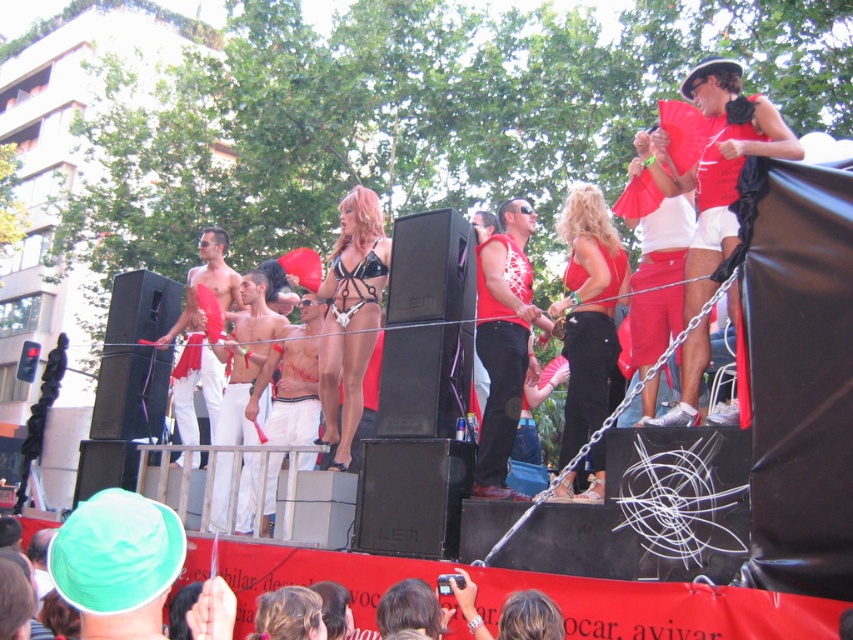
Question: Can you confirm if matte red top at center is wider than matte white pants at center?

Choices:
 (A) yes
 (B) no

Answer: (B)

Question: Can you confirm if shiny white shorts at center is wider than matte white pants at center?

Choices:
 (A) yes
 (B) no

Answer: (B)

Question: Can you confirm if matte red shorts at upper right is positioned to the right of matte red top at center?

Choices:
 (A) yes
 (B) no

Answer: (B)

Question: Which point is farther to the camera?

Choices:
 (A) black leather bikini at center
 (B) matte red bikini at center
 (C) shiny white shorts at center

Answer: (C)

Question: Which point appears closest to the camera in this image?

Choices:
 (A) (352, 342)
 (B) (223, 273)
 (C) (728, 147)
 (D) (485, 353)

Answer: (C)

Question: Which object is closer to the camera taking this photo?

Choices:
 (A) matte white pants at center
 (B) matte red shorts at upper right
 (C) matte red top at center
 (D) black leather bikini at center

Answer: (B)